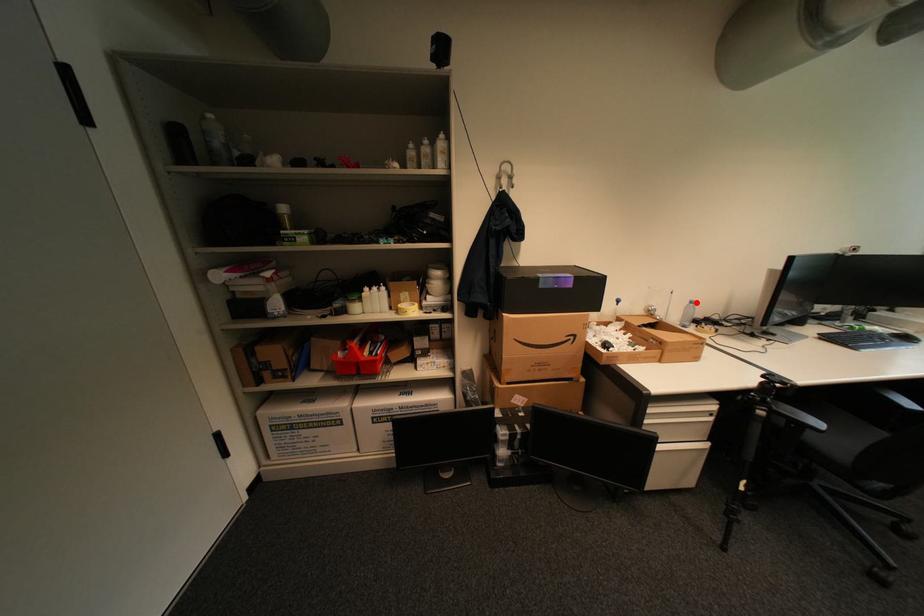
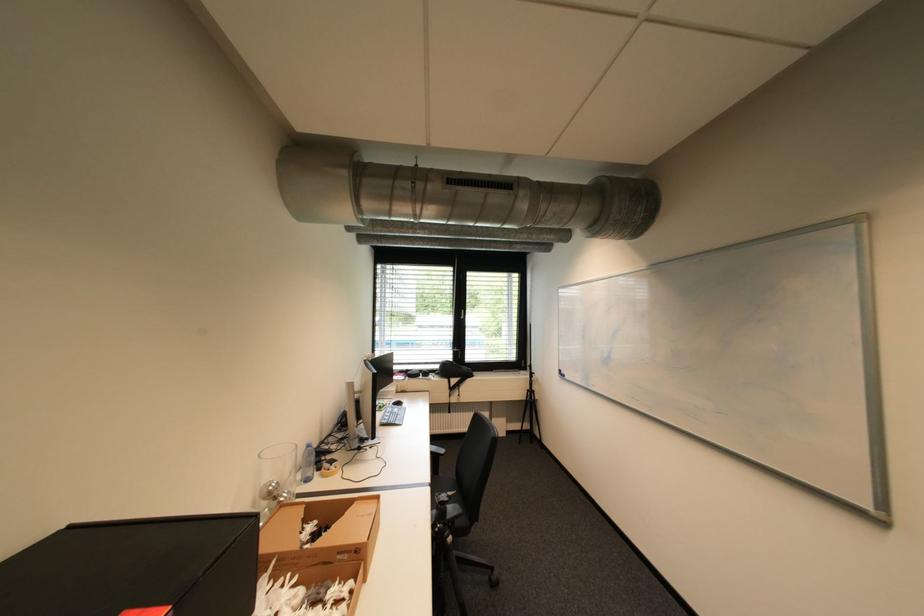
The point at the highlighted location is marked in the first image. Where is the corresponding point in the second image?

(313, 448)